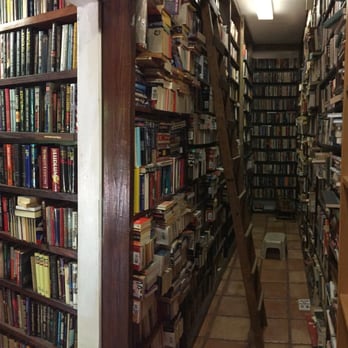
I want to click on light, so (267, 14).